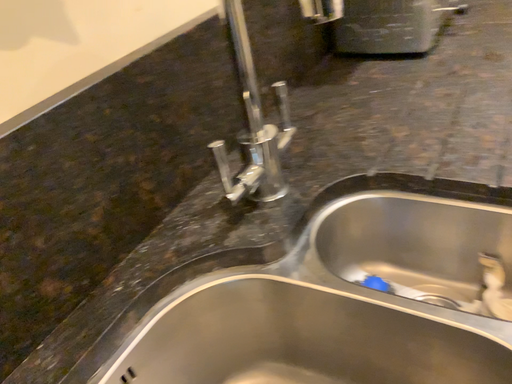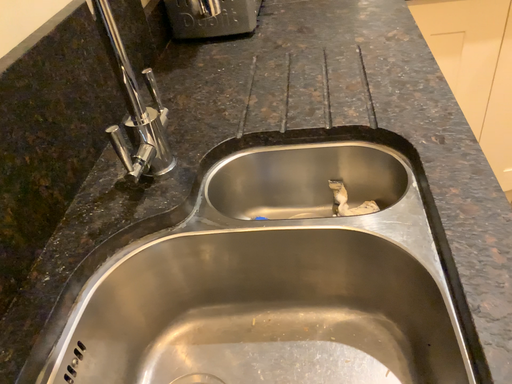
Question: How did the camera likely rotate when shooting the video?

Choices:
 (A) rotated right
 (B) rotated left

Answer: (A)